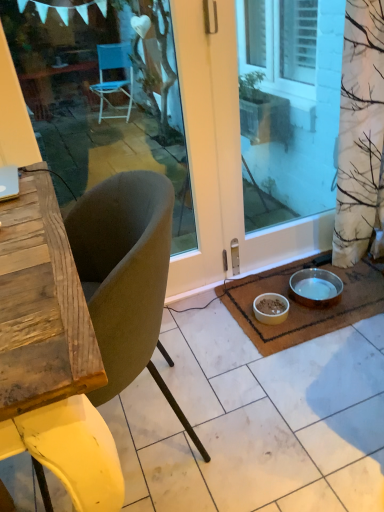
You are a GUI agent. You are given a task and a screenshot of the screen. Output one action in this format:
    pyautogui.click(x=<x>, y=<y>)
    Task: Click on the free space in front of brown woven mat at lower right
    The height and width of the screenshot is (512, 384).
    Given the screenshot: What is the action you would take?
    pyautogui.click(x=315, y=391)